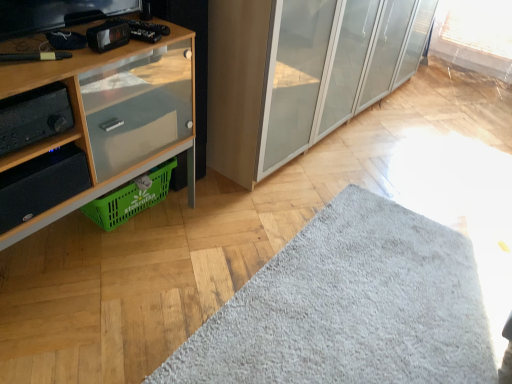
Question: In terms of width, does wooden cabinet at left look wider or thinner when compared to transparent glass cabinet at center?

Choices:
 (A) wide
 (B) thin

Answer: (B)

Question: Is wooden cabinet at left bigger or smaller than transparent glass cabinet at center?

Choices:
 (A) small
 (B) big

Answer: (A)

Question: Considering the real-world distances, which object is closest to the wooden cabinet at left?

Choices:
 (A) transparent glass cabinet at center
 (B) black matte stereo at left
 (C) gray fluffy mat at lower center
 (D) black matte speaker at lower left
 (E) green plastic basket at lower left

Answer: (D)

Question: Considering the real-world distances, which object is farthest from the black matte speaker at lower left?

Choices:
 (A) wooden cabinet at left
 (B) gray fluffy mat at lower center
 (C) black matte stereo at left
 (D) transparent glass cabinet at center
 (E) green plastic basket at lower left

Answer: (D)